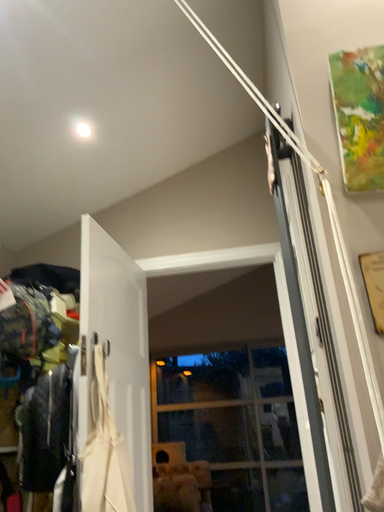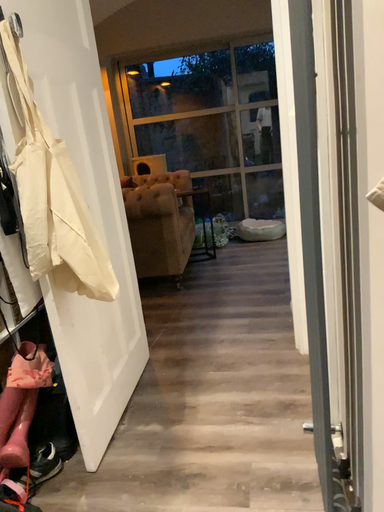
Question: Which way did the camera rotate in the video?

Choices:
 (A) rotated upward
 (B) rotated downward

Answer: (B)